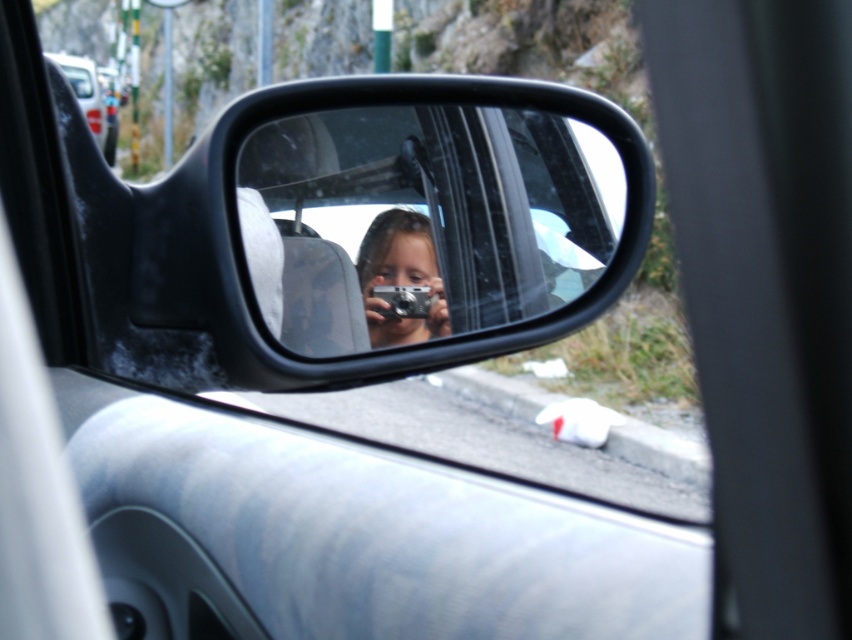
Question: Which point is closer to the camera taking this photo?

Choices:
 (A) (107, 120)
 (B) (448, 218)

Answer: (B)

Question: Is matte silver camera at center to the right of metallic silver car at upper left from the viewer's perspective?

Choices:
 (A) no
 (B) yes

Answer: (B)

Question: Estimate the real-world distances between objects in this image. Which object is closer to the clear plastic mirror at center?

Choices:
 (A) metallic silver car at upper left
 (B) matte silver camera at center

Answer: (B)

Question: Does clear plastic mirror at center have a smaller size compared to metallic silver car at upper left?

Choices:
 (A) no
 (B) yes

Answer: (B)

Question: Which of the following is the farthest from the observer?

Choices:
 (A) (605, 259)
 (B) (419, 278)

Answer: (A)

Question: Can you confirm if matte silver camera at center is positioned below metallic silver car at upper left?

Choices:
 (A) no
 (B) yes

Answer: (B)